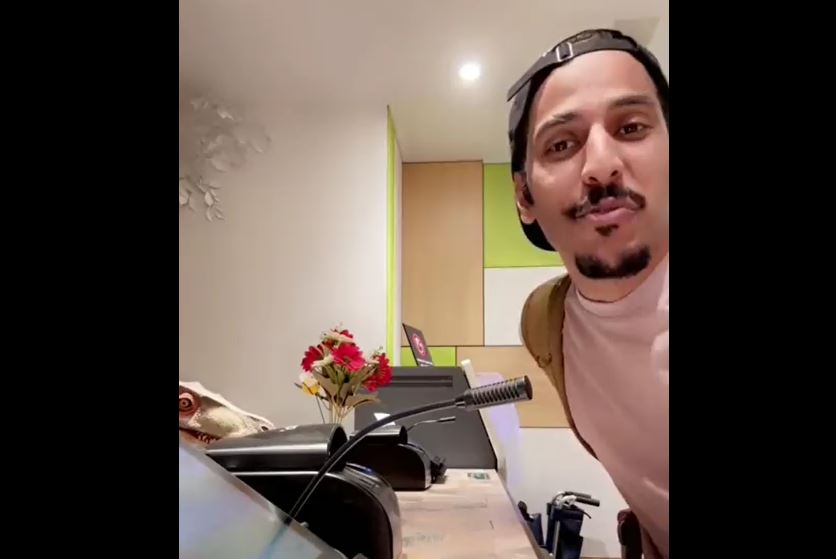
This screenshot has height=559, width=836. I want to click on light, so pos(476,69).